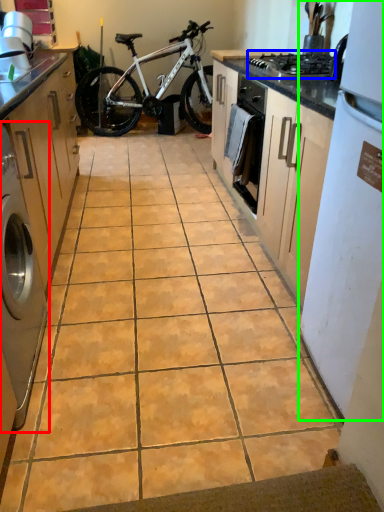
Question: Based on their relative distances, which object is farther from home appliance (highlighted by a red box)? Choose from gas stove (highlighted by a blue box) and kitchen appliance (highlighted by a green box).

Choices:
 (A) gas stove
 (B) kitchen appliance

Answer: (A)